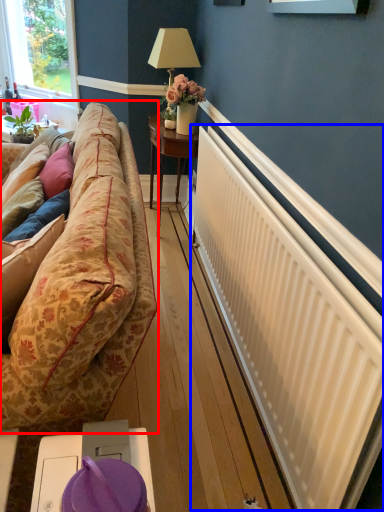
Question: Which object is further to the camera taking this photo, studio couch (highlighted by a red box) or radiator (highlighted by a blue box)?

Choices:
 (A) studio couch
 (B) radiator

Answer: (B)